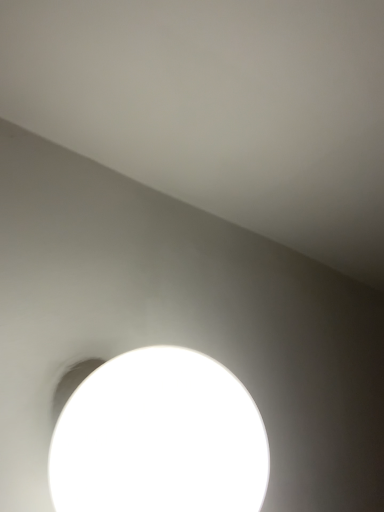
What do you see at coordinates (159, 438) in the screenshot?
I see `white glossy sphere at lower center` at bounding box center [159, 438].

The width and height of the screenshot is (384, 512). Identify the location of white glossy sphere at lower center. (159, 438).

Find the location of a particular element. This screenshot has height=512, width=384. white glossy sphere at lower center is located at coordinates (159, 438).